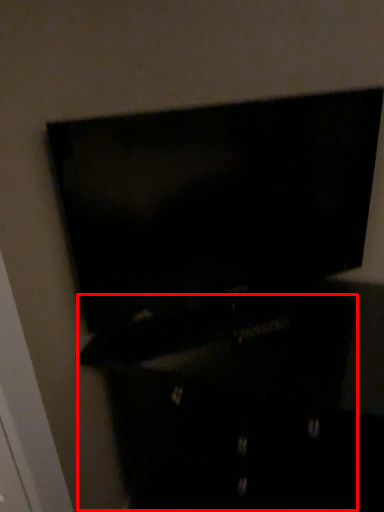
Question: From the image's perspective, where is dresser (annotated by the red box) located in relation to furniture in the image?

Choices:
 (A) above
 (B) below

Answer: (B)